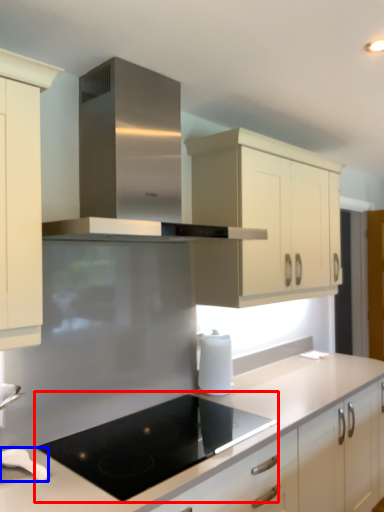
Question: Which object appears farthest to the camera in this image, gas stove (highlighted by a red box) or kitchen appliance (highlighted by a blue box)?

Choices:
 (A) gas stove
 (B) kitchen appliance

Answer: (B)